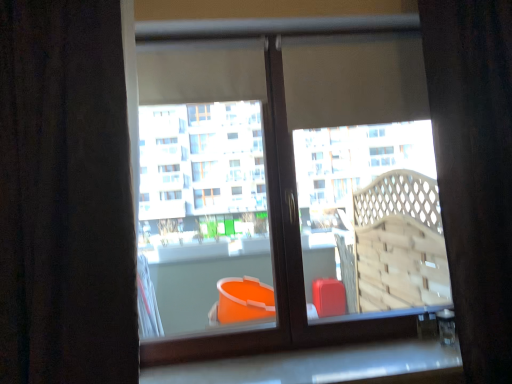
Question: Is velvet dark brown curtain at right, which is counted as the first curtain, starting from the right, directly adjacent to matte plastic bucket at center?

Choices:
 (A) yes
 (B) no

Answer: (B)

Question: Is velvet dark brown curtain at right, which is counted as the first curtain, starting from the right, positioned before matte plastic bucket at center?

Choices:
 (A) yes
 (B) no

Answer: (A)

Question: Can you confirm if velvet dark brown curtain at right, which is counted as the first curtain, starting from the right, is wider than matte plastic bucket at center?

Choices:
 (A) no
 (B) yes

Answer: (B)

Question: Is velvet dark brown curtain at right, arranged as the second curtain when viewed from the left, at the right side of matte plastic bucket at center?

Choices:
 (A) yes
 (B) no

Answer: (A)

Question: Can you confirm if velvet dark brown curtain at right, which is counted as the first curtain, starting from the right, is bigger than matte plastic bucket at center?

Choices:
 (A) no
 (B) yes

Answer: (B)

Question: Is velvet dark brown curtain at right, arranged as the second curtain when viewed from the left, facing away from matte plastic bucket at center?

Choices:
 (A) yes
 (B) no

Answer: (B)

Question: Is brown textured curtain at left, placed as the first curtain when sorted from left to right, to the right of matte plastic bucket at center from the viewer's perspective?

Choices:
 (A) yes
 (B) no

Answer: (B)

Question: Would you say brown textured curtain at left, placed as the first curtain when sorted from left to right, is outside matte plastic bucket at center?

Choices:
 (A) no
 (B) yes

Answer: (B)

Question: Is there a large distance between brown textured curtain at left, placed as the first curtain when sorted from left to right, and matte plastic bucket at center?

Choices:
 (A) no
 (B) yes

Answer: (B)

Question: Is brown textured curtain at left, placed as the first curtain when sorted from left to right, positioned with its back to matte plastic bucket at center?

Choices:
 (A) no
 (B) yes

Answer: (A)

Question: Is brown textured curtain at left, arranged as the 2th curtain when viewed from the right, further to the viewer compared to matte plastic bucket at center?

Choices:
 (A) yes
 (B) no

Answer: (B)

Question: Can you confirm if brown textured curtain at left, placed as the first curtain when sorted from left to right, is thinner than matte plastic bucket at center?

Choices:
 (A) yes
 (B) no

Answer: (B)

Question: Does white marble window sill at lower center turn towards brown textured curtain at left, placed as the first curtain when sorted from left to right?

Choices:
 (A) no
 (B) yes

Answer: (A)